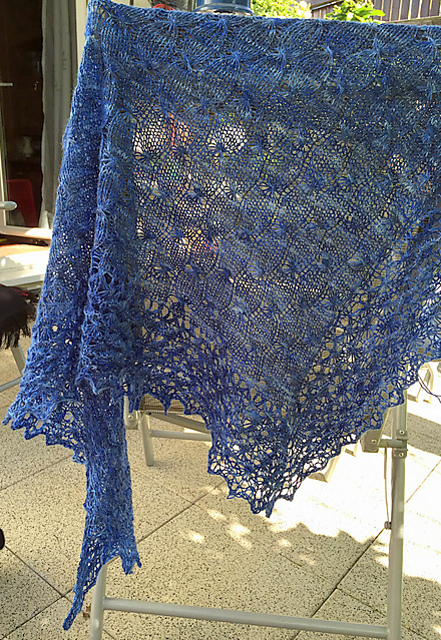
Locate an element on the screen. The width and height of the screenshot is (441, 640). floor is located at coordinates (428, 556).